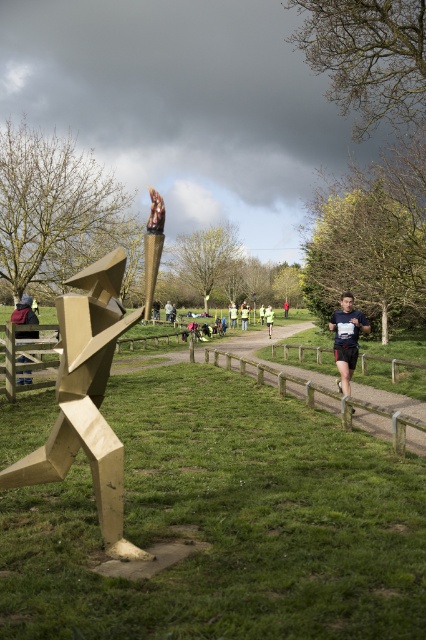
Question: Is green grassy at left in front of green reflective vest at center?

Choices:
 (A) no
 (B) yes

Answer: (B)

Question: Which point appears farthest from the camera in this image?

Choices:
 (A) coord(149,266)
 (B) coord(262,304)
 (C) coord(342,381)
 (D) coord(31,378)

Answer: (B)

Question: Does green grassy at left have a smaller size compared to yellow fabric runner at center?

Choices:
 (A) yes
 (B) no

Answer: (B)

Question: Is the position of green grassy at left more distant than that of dark blue fabric runner at center?

Choices:
 (A) yes
 (B) no

Answer: (B)

Question: Considering the real-world distances, which object is farthest from the gold metallic sculpture at left?

Choices:
 (A) wooden bench at left
 (B) matte black running suit at center
 (C) green reflective vest at center
 (D) dark blue fabric runner at center

Answer: (D)

Question: Which of the following is the closest to the observer?

Choices:
 (A) wooden bench at left
 (B) matte black running suit at center
 (C) red fabric runner at center
 (D) green reflective jacket at center

Answer: (B)